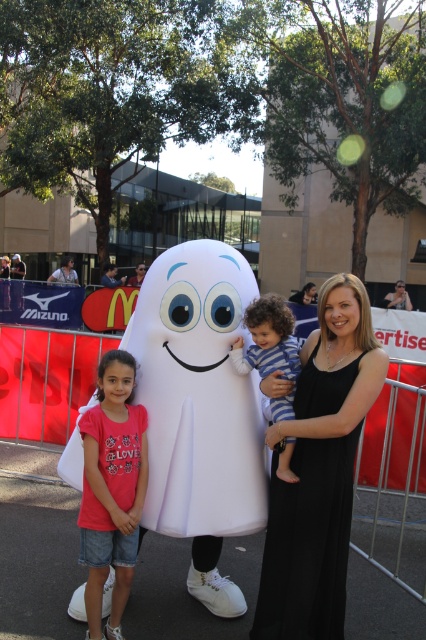
Question: Estimate the real-world distances between objects in this image. Which object is farther from the matte pink shirt at left?

Choices:
 (A) blue striped pajamas at center
 (B) black satin dress at center

Answer: (B)

Question: From the image, what is the correct spatial relationship of black satin dress at center in relation to blue striped pajamas at center?

Choices:
 (A) above
 (B) below

Answer: (B)

Question: Among these points, which one is nearest to the camera?

Choices:
 (A) (350, 499)
 (B) (287, 362)

Answer: (A)

Question: Considering the real-world distances, which object is closest to the matte pink shirt at left?

Choices:
 (A) blue striped pajamas at center
 (B) black satin dress at center

Answer: (A)

Question: Can you confirm if black satin dress at center is positioned to the left of matte pink shirt at left?

Choices:
 (A) yes
 (B) no

Answer: (B)

Question: Does black satin dress at center appear under blue striped pajamas at center?

Choices:
 (A) no
 (B) yes

Answer: (B)